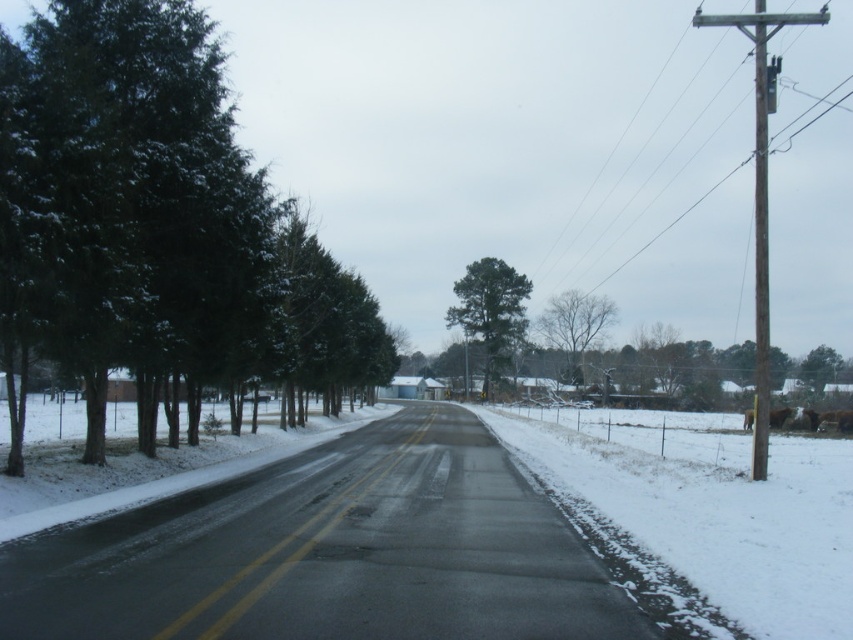
Question: Which object is closer to the camera taking this photo?

Choices:
 (A) brown wooden telegraph pole at right
 (B) green matte tree at center
 (C) black asphalt road at center

Answer: (C)

Question: From the image, what is the correct spatial relationship of green matte trees at left in relation to green matte tree at center?

Choices:
 (A) below
 (B) above

Answer: (A)

Question: Which point is farther from the camera taking this photo?

Choices:
 (A) (564, 316)
 (B) (343, 509)
 (C) (712, 13)
 (D) (283, 252)

Answer: (C)

Question: Can you confirm if brown wooden telegraph pole at right is bigger than black asphalt road at center?

Choices:
 (A) no
 (B) yes

Answer: (B)

Question: Based on their relative distances, which object is farther from the green matte trees at left?

Choices:
 (A) brown wooden telegraph pole at right
 (B) green matte tree at center

Answer: (B)

Question: Can you confirm if black asphalt road at center is thinner than bare branches at center?

Choices:
 (A) yes
 (B) no

Answer: (A)